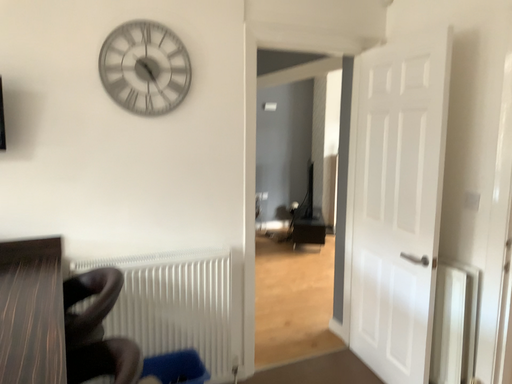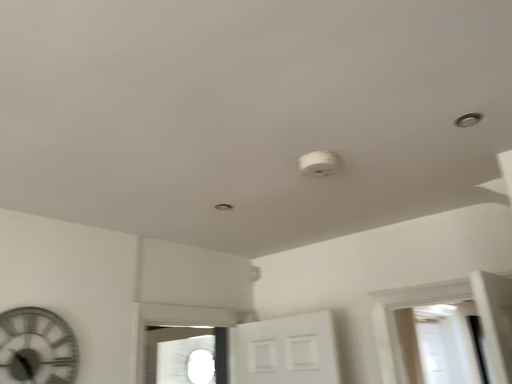
Question: Which way did the camera rotate in the video?

Choices:
 (A) rotated right
 (B) rotated left

Answer: (A)